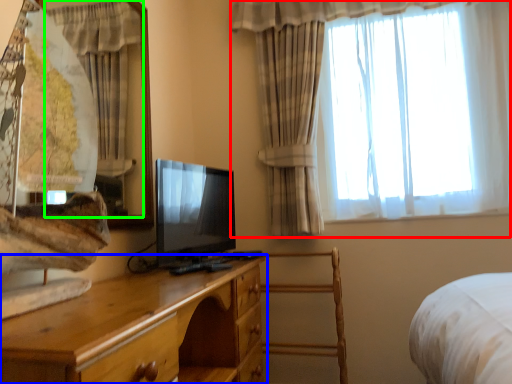
Question: Which object is positioned farthest from curtain (highlighted by a red box)? Select from chest of drawers (highlighted by a blue box) and curtain (highlighted by a green box).

Choices:
 (A) chest of drawers
 (B) curtain

Answer: (A)